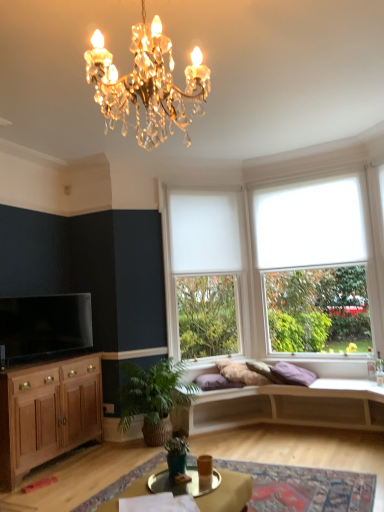
The width and height of the screenshot is (384, 512). Find the location of `free space above white matte blind at upper center (from a real-world perspective)`. free space above white matte blind at upper center (from a real-world perspective) is located at coordinates (187, 188).